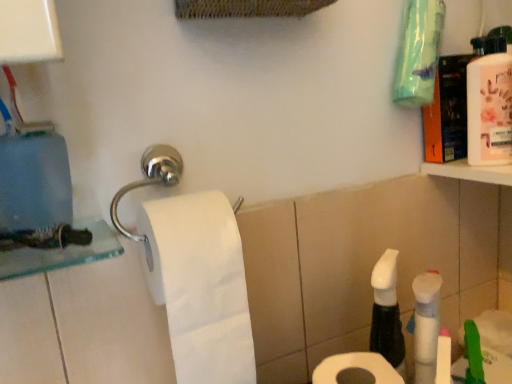
Describe the element at coordinates (490, 105) in the screenshot. I see `pink glossy mouthwash at upper right` at that location.

Where is `white matte toilet paper at lower center, which is counted as the 2th toilet paper, starting from the left`? The width and height of the screenshot is (512, 384). white matte toilet paper at lower center, which is counted as the 2th toilet paper, starting from the left is located at coordinates (356, 370).

Find the location of a particular element. The width and height of the screenshot is (512, 384). pink glossy mouthwash at upper right is located at coordinates (490, 105).

Would you say white matte toilet paper at lower center, the first toilet paper viewed from the right, is to the left or to the right of white matte toilet paper at center, which is the 1th toilet paper in left-to-right order, in the picture?

From the image, it's evident that white matte toilet paper at lower center, the first toilet paper viewed from the right, is to the right of white matte toilet paper at center, which is the 1th toilet paper in left-to-right order.

Find the location of a particular element. toilet paper above the white matte toilet paper at lower center, which is counted as the 2th toilet paper, starting from the left (from a real-world perspective) is located at coordinates (201, 286).

From a real-world perspective, is white matte toilet paper at lower center, which is counted as the 2th toilet paper, starting from the left, physically above white matte toilet paper at center, which is the 1th toilet paper in left-to-right order?

No, from a real-world perspective, white matte toilet paper at lower center, which is counted as the 2th toilet paper, starting from the left, is not above white matte toilet paper at center, which is the 1th toilet paper in left-to-right order.

Does white matte toilet paper at lower center, the first toilet paper viewed from the right, have a greater width compared to white matte toilet paper at center, which is the 1th toilet paper in left-to-right order?

No.

From a real-world perspective, is pink glossy mouthwash at upper right located higher than white matte toilet paper at lower center, the first toilet paper viewed from the right?

Indeed, from a real-world perspective, pink glossy mouthwash at upper right stands above white matte toilet paper at lower center, the first toilet paper viewed from the right.

Would you say pink glossy mouthwash at upper right is to the left or to the right of white matte toilet paper at lower center, the first toilet paper viewed from the right, in the picture?

From the image, it's evident that pink glossy mouthwash at upper right is to the right of white matte toilet paper at lower center, the first toilet paper viewed from the right.

Which point is more distant from viewer, (476, 121) or (314, 377)?

The point (476, 121) is behind.

Locate an element on the screen. The height and width of the screenshot is (384, 512). the 1st toilet paper in front of the pink glossy mouthwash at upper right, starting your count from the anchor is located at coordinates (201, 286).

From a real-world perspective, between pink glossy mouthwash at upper right and white matte toilet paper at center, the 2th toilet paper in the right-to-left sequence, who is vertically higher?

pink glossy mouthwash at upper right.

Is point (510, 94) in front of point (159, 303)?

No, (510, 94) is further to viewer.

Could you tell me if white matte toilet paper at center, the 2th toilet paper in the right-to-left sequence, is facing pink glossy mouthwash at upper right?

No, white matte toilet paper at center, the 2th toilet paper in the right-to-left sequence, does not turn towards pink glossy mouthwash at upper right.

Does white matte toilet paper at center, which is the 1th toilet paper in left-to-right order, have a greater height compared to pink glossy mouthwash at upper right?

Correct, white matte toilet paper at center, which is the 1th toilet paper in left-to-right order, is much taller as pink glossy mouthwash at upper right.

Which object is wider, white matte toilet paper at center, which is the 1th toilet paper in left-to-right order, or pink glossy mouthwash at upper right?

white matte toilet paper at center, which is the 1th toilet paper in left-to-right order.

From the image's perspective, who appears lower, white matte toilet paper at lower center, the first toilet paper viewed from the right, or pink glossy mouthwash at upper right?

From the image's view, white matte toilet paper at lower center, the first toilet paper viewed from the right, is below.

From a real-world perspective, relative to pink glossy mouthwash at upper right, is white matte toilet paper at lower center, which is counted as the 2th toilet paper, starting from the left, vertically above or below?

white matte toilet paper at lower center, which is counted as the 2th toilet paper, starting from the left, is below pink glossy mouthwash at upper right.

Is white matte toilet paper at lower center, which is counted as the 2th toilet paper, starting from the left, wider or thinner than pink glossy mouthwash at upper right?

white matte toilet paper at lower center, which is counted as the 2th toilet paper, starting from the left, is wider than pink glossy mouthwash at upper right.

Is white matte toilet paper at center, which is the 1th toilet paper in left-to-right order, not close to white matte toilet paper at lower center, the first toilet paper viewed from the right?

white matte toilet paper at center, which is the 1th toilet paper in left-to-right order, is actually quite close to white matte toilet paper at lower center, the first toilet paper viewed from the right.

From the image's perspective, which one is positioned lower, white matte toilet paper at center, the 2th toilet paper in the right-to-left sequence, or white matte toilet paper at lower center, which is counted as the 2th toilet paper, starting from the left?

white matte toilet paper at lower center, which is counted as the 2th toilet paper, starting from the left, is shown below in the image.

Is the depth of white matte toilet paper at center, which is the 1th toilet paper in left-to-right order, less than that of white matte toilet paper at lower center, the first toilet paper viewed from the right?

No, white matte toilet paper at center, which is the 1th toilet paper in left-to-right order, is further to the viewer.

Considering the sizes of objects white matte toilet paper at center, which is the 1th toilet paper in left-to-right order, and white matte toilet paper at lower center, which is counted as the 2th toilet paper, starting from the left, in the image provided, who is smaller, white matte toilet paper at center, which is the 1th toilet paper in left-to-right order, or white matte toilet paper at lower center, which is counted as the 2th toilet paper, starting from the left,?

With smaller size is white matte toilet paper at lower center, which is counted as the 2th toilet paper, starting from the left.

This screenshot has height=384, width=512. What are the coordinates of `toilet paper located above the white matte toilet paper at lower center, the first toilet paper viewed from the right (from a real-world perspective)` in the screenshot? It's located at (201, 286).

Starting from the pink glossy mouthwash at upper right, which toilet paper is the 1st one to the left? Please provide its 2D coordinates.

[(356, 370)]

When comparing their distances from white matte toilet paper at center, the 2th toilet paper in the right-to-left sequence, does white matte toilet paper at lower center, which is counted as the 2th toilet paper, starting from the left, or pink glossy mouthwash at upper right seem closer?

white matte toilet paper at lower center, which is counted as the 2th toilet paper, starting from the left, is positioned closer to the anchor white matte toilet paper at center, the 2th toilet paper in the right-to-left sequence.

Considering their positions, is pink glossy mouthwash at upper right positioned closer to white matte toilet paper at lower center, which is counted as the 2th toilet paper, starting from the left, than white matte toilet paper at center, the 2th toilet paper in the right-to-left sequence?

The object closer to white matte toilet paper at lower center, which is counted as the 2th toilet paper, starting from the left, is white matte toilet paper at center, the 2th toilet paper in the right-to-left sequence.

Which object lies nearer to the anchor point pink glossy mouthwash at upper right, white matte toilet paper at lower center, which is counted as the 2th toilet paper, starting from the left, or white matte toilet paper at center, the 2th toilet paper in the right-to-left sequence?

white matte toilet paper at lower center, which is counted as the 2th toilet paper, starting from the left, is closer to pink glossy mouthwash at upper right.

Which object lies further to the anchor point pink glossy mouthwash at upper right, white matte toilet paper at center, the 2th toilet paper in the right-to-left sequence, or white matte toilet paper at lower center, which is counted as the 2th toilet paper, starting from the left?

white matte toilet paper at center, the 2th toilet paper in the right-to-left sequence.

When comparing their distances from white matte toilet paper at lower center, which is counted as the 2th toilet paper, starting from the left, does white matte toilet paper at center, the 2th toilet paper in the right-to-left sequence, or pink glossy mouthwash at upper right seem closer?

The object closer to white matte toilet paper at lower center, which is counted as the 2th toilet paper, starting from the left, is white matte toilet paper at center, the 2th toilet paper in the right-to-left sequence.

Estimate the real-world distances between objects in this image. Which object is further from white matte toilet paper at center, the 2th toilet paper in the right-to-left sequence, pink glossy mouthwash at upper right or white matte toilet paper at lower center, the first toilet paper viewed from the right?

Based on the image, pink glossy mouthwash at upper right appears to be further to white matte toilet paper at center, the 2th toilet paper in the right-to-left sequence.

Locate an element on the screen. Image resolution: width=512 pixels, height=384 pixels. toilet paper between pink glossy mouthwash at upper right and white matte toilet paper at lower center, the first toilet paper viewed from the right, in the vertical direction is located at coordinates (201, 286).